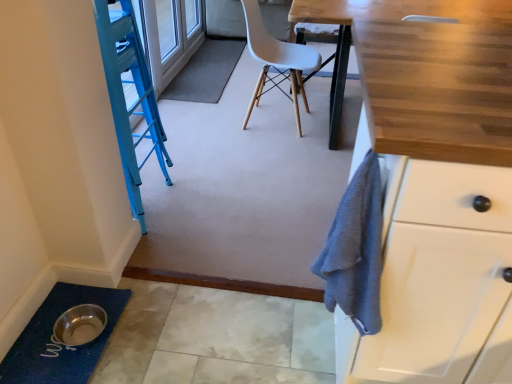
The height and width of the screenshot is (384, 512). Find the location of `blue textured bath mat at lower left, the 2th bath mat in the top-to-bottom sequence`. blue textured bath mat at lower left, the 2th bath mat in the top-to-bottom sequence is located at coordinates pos(57,344).

Find the location of a particular element. This screenshot has width=512, height=384. blue textured bath mat at lower left, the 2th bath mat in the top-to-bottom sequence is located at coordinates (57, 344).

Is gray carpet at center, the 1th bath mat positioned from the top, at the back of white plastic chair at center?

No.

Considering the sizes of white plastic chair at center and gray carpet at center, the 2th bath mat from the bottom, in the image, is white plastic chair at center wider or thinner than gray carpet at center, the 2th bath mat from the bottom,?

Clearly, white plastic chair at center has more width compared to gray carpet at center, the 2th bath mat from the bottom.

Consider the image. Can we say white plastic chair at center lies outside gray carpet at center, which appears as the first bath mat when viewed from the back?

That's correct, white plastic chair at center is outside of gray carpet at center, which appears as the first bath mat when viewed from the back.

Considering the positions of objects white plastic chair at center and gray carpet at center, the 1th bath mat positioned from the top, in the image provided, who is more to the right, white plastic chair at center or gray carpet at center, the 1th bath mat positioned from the top,?

From the viewer's perspective, white plastic chair at center appears more on the right side.

From the image's perspective, between blue textured bath mat at lower left, positioned as the 1th bath mat in front-to-back order, and white plastic chair at center, who is located below?

blue textured bath mat at lower left, positioned as the 1th bath mat in front-to-back order.

Do you think blue textured bath mat at lower left, the 2th bath mat viewed from the back, is within white plastic chair at center, or outside of it?

blue textured bath mat at lower left, the 2th bath mat viewed from the back, is spatially situated outside white plastic chair at center.

Considering the sizes of blue textured bath mat at lower left, positioned as the 1th bath mat in front-to-back order, and white plastic chair at center in the image, is blue textured bath mat at lower left, positioned as the 1th bath mat in front-to-back order, wider or thinner than white plastic chair at center?

In the image, blue textured bath mat at lower left, positioned as the 1th bath mat in front-to-back order, appears to be more narrow than white plastic chair at center.

Does blue textured bath mat at lower left, the 2th bath mat viewed from the back, appear on the right side of white plastic chair at center?

No.

From a real-world perspective, is blue textured bath mat at lower left, the 2th bath mat viewed from the back, below gray carpet at center, the 2th bath mat from the bottom?

Yes, from a real-world perspective, blue textured bath mat at lower left, the 2th bath mat viewed from the back, is under gray carpet at center, the 2th bath mat from the bottom.

At what (x,y) coordinates should I click in order to perform the action: click on bath mat below the gray carpet at center, the 1th bath mat positioned from the top (from a real-world perspective). Please return your answer as a coordinate pair (x, y). The image size is (512, 384). Looking at the image, I should click on coord(57,344).

From the image's perspective, who appears lower, blue textured bath mat at lower left, positioned as the 1th bath mat in front-to-back order, or gray carpet at center, the 1th bath mat positioned from the top?

blue textured bath mat at lower left, positioned as the 1th bath mat in front-to-back order, from the image's perspective.

Is blue textured bath mat at lower left, positioned as the 1th bath mat in front-to-back order, directly adjacent to gray carpet at center, the 1th bath mat positioned from the top?

blue textured bath mat at lower left, positioned as the 1th bath mat in front-to-back order, and gray carpet at center, the 1th bath mat positioned from the top, are clearly separated.

Considering the relative positions of gray carpet at center, the 1th bath mat positioned from the top, and white plastic chair at center in the image provided, is gray carpet at center, the 1th bath mat positioned from the top, to the left or to the right of white plastic chair at center?

Clearly, gray carpet at center, the 1th bath mat positioned from the top, is on the left of white plastic chair at center in the image.

Is gray carpet at center, which appears as the first bath mat when viewed from the back, closer to the viewer compared to white plastic chair at center?

No, gray carpet at center, which appears as the first bath mat when viewed from the back, is further to the viewer.

Is gray carpet at center, the 2th bath mat from the bottom, wider than white plastic chair at center?

No.

Image resolution: width=512 pixels, height=384 pixels. Identify the location of chair located above the gray carpet at center, which appears as the first bath mat when viewed from the back (from a real-world perspective). (277, 61).

Does point (275, 85) lie behind point (52, 349)?

That is True.

Looking at their sizes, would you say white plastic chair at center is wider or thinner than blue textured bath mat at lower left, the 2th bath mat viewed from the back?

Clearly, white plastic chair at center has more width compared to blue textured bath mat at lower left, the 2th bath mat viewed from the back.

Is white plastic chair at center positioned far away from blue textured bath mat at lower left, the 1th bath mat ordered from the bottom?

Indeed, white plastic chair at center is not near blue textured bath mat at lower left, the 1th bath mat ordered from the bottom.

Does gray carpet at center, which appears as the first bath mat when viewed from the back, touch blue textured bath mat at lower left, the 2th bath mat viewed from the back?

They are not placed beside each other.

From a real-world perspective, is gray carpet at center, the 2th bath mat from the bottom, under blue textured bath mat at lower left, the 1th bath mat ordered from the bottom?

No, from a real-world perspective, gray carpet at center, the 2th bath mat from the bottom, is not under blue textured bath mat at lower left, the 1th bath mat ordered from the bottom.

Based on the photo, is gray carpet at center, which appears as the first bath mat when viewed from the back, oriented towards blue textured bath mat at lower left, the 2th bath mat in the top-to-bottom sequence?

No, gray carpet at center, which appears as the first bath mat when viewed from the back, is not turned towards blue textured bath mat at lower left, the 2th bath mat in the top-to-bottom sequence.

Consider the image. Is gray carpet at center, which appears as the first bath mat when viewed from the back, wider than blue textured bath mat at lower left, positioned as the 1th bath mat in front-to-back order?

Indeed, gray carpet at center, which appears as the first bath mat when viewed from the back, has a greater width compared to blue textured bath mat at lower left, positioned as the 1th bath mat in front-to-back order.

Where is `chair that is in front of the gray carpet at center, the 2th bath mat positioned from the front`? chair that is in front of the gray carpet at center, the 2th bath mat positioned from the front is located at coordinates (277, 61).

The image size is (512, 384). In order to click on chair behind the blue textured bath mat at lower left, the 2th bath mat in the top-to-bottom sequence in this screenshot , I will do `click(277, 61)`.

Considering their positions, is gray carpet at center, which appears as the first bath mat when viewed from the back, positioned closer to white plastic chair at center than blue textured bath mat at lower left, the 2th bath mat in the top-to-bottom sequence?

gray carpet at center, which appears as the first bath mat when viewed from the back, is closer to white plastic chair at center.

Which object lies further to the anchor point white plastic chair at center, blue textured bath mat at lower left, positioned as the 1th bath mat in front-to-back order, or gray carpet at center, the 1th bath mat positioned from the top?

Among the two, blue textured bath mat at lower left, positioned as the 1th bath mat in front-to-back order, is located further to white plastic chair at center.

Looking at the image, which one is located further to blue textured bath mat at lower left, the 1th bath mat ordered from the bottom, gray carpet at center, the 1th bath mat positioned from the top, or white plastic chair at center?

gray carpet at center, the 1th bath mat positioned from the top, is further to blue textured bath mat at lower left, the 1th bath mat ordered from the bottom.

Based on their spatial positions, is white plastic chair at center or gray carpet at center, the 1th bath mat positioned from the top, closer to blue textured bath mat at lower left, the 2th bath mat in the top-to-bottom sequence?

white plastic chair at center is positioned closer to the anchor blue textured bath mat at lower left, the 2th bath mat in the top-to-bottom sequence.

From the image, which object appears to be nearer to gray carpet at center, the 2th bath mat positioned from the front, blue textured bath mat at lower left, the 1th bath mat ordered from the bottom, or white plastic chair at center?

white plastic chair at center lies closer to gray carpet at center, the 2th bath mat positioned from the front, than the other object.

Based on their spatial positions, is white plastic chair at center or blue textured bath mat at lower left, positioned as the 1th bath mat in front-to-back order, closer to gray carpet at center, the 1th bath mat positioned from the top?

white plastic chair at center is closer to gray carpet at center, the 1th bath mat positioned from the top.

Find the location of a particular element. This screenshot has width=512, height=384. chair positioned between blue textured bath mat at lower left, the 2th bath mat viewed from the back, and gray carpet at center, the 2th bath mat from the bottom, from near to far is located at coordinates [x=277, y=61].